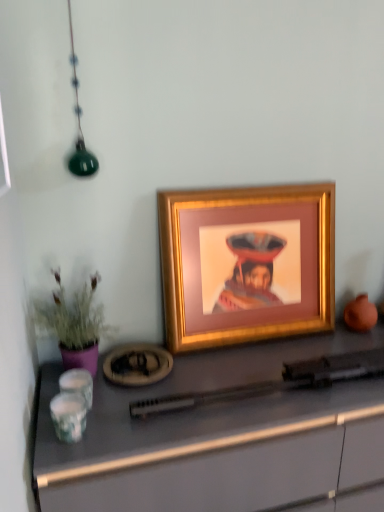
Question: From a real-world perspective, is gold metallic picture frame at center over purple matte plant at left?

Choices:
 (A) no
 (B) yes

Answer: (B)

Question: From the image's perspective, would you say gold metallic picture frame at center is shown under purple matte plant at left?

Choices:
 (A) no
 (B) yes

Answer: (A)

Question: Is gold metallic picture frame at center next to purple matte plant at left?

Choices:
 (A) yes
 (B) no

Answer: (B)

Question: From the image's perspective, is gold metallic picture frame at center over purple matte plant at left?

Choices:
 (A) yes
 (B) no

Answer: (A)

Question: Can you confirm if gold metallic picture frame at center is positioned to the right of purple matte plant at left?

Choices:
 (A) no
 (B) yes

Answer: (B)

Question: Looking at their shapes, would you say gold metallic picture frame at center is wider or thinner than matte gray desk at center?

Choices:
 (A) thin
 (B) wide

Answer: (A)

Question: Is gold metallic picture frame at center inside or outside of matte gray desk at center?

Choices:
 (A) outside
 (B) inside

Answer: (A)

Question: From the image's perspective, is gold metallic picture frame at center positioned above or below matte gray desk at center?

Choices:
 (A) below
 (B) above

Answer: (B)

Question: From a real-world perspective, is gold metallic picture frame at center physically located above or below matte gray desk at center?

Choices:
 (A) above
 (B) below

Answer: (A)

Question: In terms of size, does matte gray desk at center appear bigger or smaller than purple matte plant at left?

Choices:
 (A) small
 (B) big

Answer: (B)

Question: Considering their positions, is matte gray desk at center located in front of or behind purple matte plant at left?

Choices:
 (A) front
 (B) behind

Answer: (A)

Question: Is matte gray desk at center inside or outside of purple matte plant at left?

Choices:
 (A) outside
 (B) inside

Answer: (A)

Question: Is point (102, 423) closer or farther from the camera than point (74, 349)?

Choices:
 (A) farther
 (B) closer

Answer: (B)

Question: Looking at their shapes, would you say gold metallic picture frame at center is wider or thinner than purple matte plant at left?

Choices:
 (A) thin
 (B) wide

Answer: (A)

Question: Which is correct: gold metallic picture frame at center is inside purple matte plant at left, or outside of it?

Choices:
 (A) inside
 (B) outside

Answer: (B)